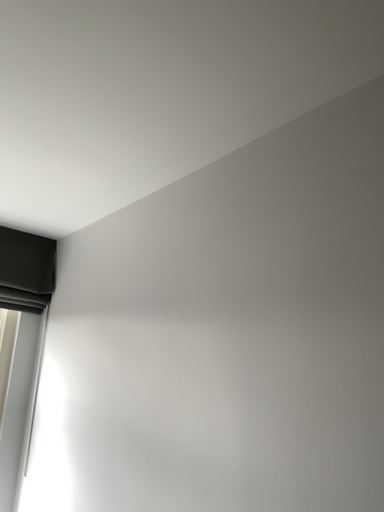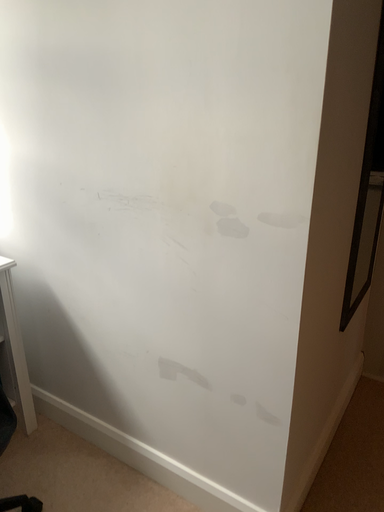
Question: How did the camera likely rotate when shooting the video?

Choices:
 (A) rotated right
 (B) rotated left

Answer: (A)